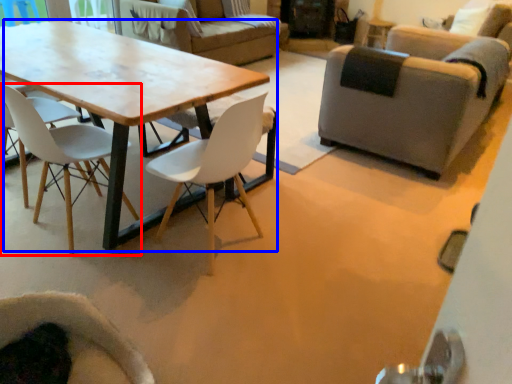
Question: Which object is further to the camera taking this photo, chair (highlighted by a red box) or coffee table (highlighted by a blue box)?

Choices:
 (A) chair
 (B) coffee table

Answer: (A)